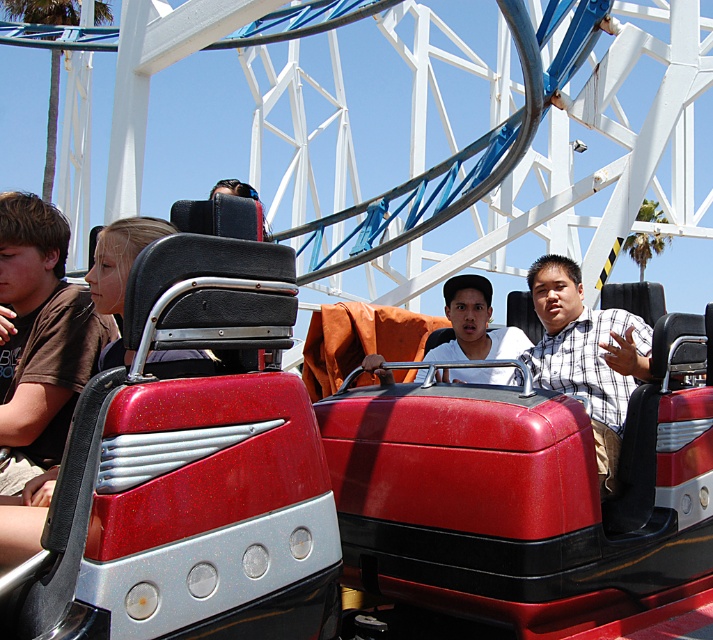
In the scene shown: You are designing a new seat for the roller coaster cars. The brown cotton shirt at left and the checkered fabric shirt at center are two different styles of clothing worn by passengers. Which shirt requires a wider seat design to accommodate its width?

The checkered fabric shirt at center requires a wider seat design because it has a greater width compared to the brown cotton shirt at left.

You are a photographer standing at the back of the roller coaster cars. You want to take a photo of both the checkered fabric shirt at center and the white matte shirt at center. Which shirt is closer to you?

The checkered fabric shirt at center is positioned under the white matte shirt at center, so the white matte shirt at center is closer to you.